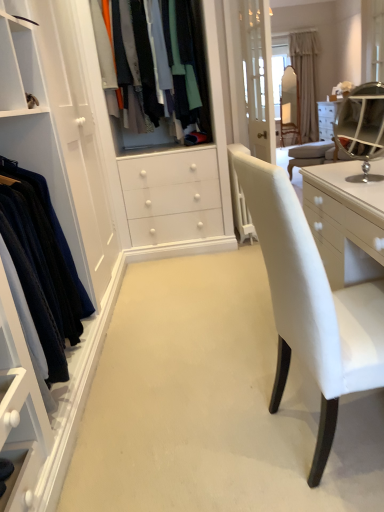
The width and height of the screenshot is (384, 512). What do you see at coordinates (188, 65) in the screenshot?
I see `matte fabric shirts at center, which appears as the 1th clothing when viewed from the back` at bounding box center [188, 65].

Describe the element at coordinates (305, 81) in the screenshot. I see `beige fabric curtain at upper center` at that location.

Locate an element on the screen. The width and height of the screenshot is (384, 512). silver/metallic vanity mirror at upper right is located at coordinates (362, 125).

What are the coordinates of `velvet blue sweater at left, the second clothing positioned from the top` in the screenshot? It's located at (42, 265).

Find the location of a particular element. The height and width of the screenshot is (512, 384). matte fabric shirts at center, placed as the 2th clothing when sorted from front to back is located at coordinates (188, 65).

Is the position of beige fabric curtain at upper center more distant than that of silver/metallic vanity mirror at upper right?

Yes, the depth of beige fabric curtain at upper center is greater than that of silver/metallic vanity mirror at upper right.

Where is `mirror to the left of beige fabric curtain at upper center`? This screenshot has height=512, width=384. mirror to the left of beige fabric curtain at upper center is located at coordinates (362, 125).

What's the angular difference between beige fabric curtain at upper center and silver/metallic vanity mirror at upper right's facing directions?

There is a 52.4-degree angle between the facing directions of beige fabric curtain at upper center and silver/metallic vanity mirror at upper right.

Is beige fabric curtain at upper center taller or shorter than silver/metallic vanity mirror at upper right?

beige fabric curtain at upper center is taller than silver/metallic vanity mirror at upper right.

Does silver/metallic vanity mirror at upper right have a lesser width compared to velvet blue sweater at left, the 2th clothing in the back-to-front sequence?

Yes, silver/metallic vanity mirror at upper right is thinner than velvet blue sweater at left, the 2th clothing in the back-to-front sequence.

Which is in front, point (355, 123) or point (66, 252)?

Positioned in front is point (66, 252).

From the image's perspective, would you say silver/metallic vanity mirror at upper right is shown under velvet blue sweater at left, marked as the first clothing in a front-to-back arrangement?

No, from the image's perspective, silver/metallic vanity mirror at upper right is not below velvet blue sweater at left, marked as the first clothing in a front-to-back arrangement.

Which is nearer, (x=60, y=328) or (x=301, y=112)?

Point (x=60, y=328) appears to be closer to the viewer than point (x=301, y=112).

There is a velvet blue sweater at left, the second clothing positioned from the top. At what (x,y) coordinates should I click in order to perform the action: click on curtain above it (from a real-world perspective). Please return your answer as a coordinate pair (x, y). This screenshot has height=512, width=384. Looking at the image, I should click on (305, 81).

Does velvet blue sweater at left, marked as the first clothing in a front-to-back arrangement, have a lesser width compared to beige fabric curtain at upper center?

No, velvet blue sweater at left, marked as the first clothing in a front-to-back arrangement, is not thinner than beige fabric curtain at upper center.

Does point (311, 50) appear closer or farther from the camera than point (121, 85)?

Point (311, 50) appears to be farther away from the viewer than point (121, 85).

Is beige fabric curtain at upper center spatially inside matte fabric shirts at center, which appears as the 1th clothing when viewed from the back, or outside of it?

beige fabric curtain at upper center cannot be found inside matte fabric shirts at center, which appears as the 1th clothing when viewed from the back.

Considering the sizes of objects beige fabric curtain at upper center and matte fabric shirts at center, arranged as the 1th clothing when viewed from the top, in the image provided, who is smaller, beige fabric curtain at upper center or matte fabric shirts at center, arranged as the 1th clothing when viewed from the top,?

matte fabric shirts at center, arranged as the 1th clothing when viewed from the top, is smaller.

Image resolution: width=384 pixels, height=512 pixels. Identify the location of curtain behind the matte fabric shirts at center, placed as the 2th clothing when sorted from front to back. (305, 81).

Between matte fabric shirts at center, arranged as the second clothing when ordered from the bottom, and beige fabric curtain at upper center, which one has larger width?

With larger width is matte fabric shirts at center, arranged as the second clothing when ordered from the bottom.

From a real-world perspective, between matte fabric shirts at center, arranged as the second clothing when ordered from the bottom, and beige fabric curtain at upper center, who is vertically higher?

In real-world perspective, matte fabric shirts at center, arranged as the second clothing when ordered from the bottom, is above.

From the image's perspective, is matte fabric shirts at center, arranged as the 1th clothing when viewed from the top, above beige fabric curtain at upper center?

Incorrect, from the image's perspective, matte fabric shirts at center, arranged as the 1th clothing when viewed from the top, is lower than beige fabric curtain at upper center.

Is matte fabric shirts at center, arranged as the 1th clothing when viewed from the top, inside the boundaries of beige fabric curtain at upper center, or outside?

matte fabric shirts at center, arranged as the 1th clothing when viewed from the top, is not enclosed by beige fabric curtain at upper center.

From the image's perspective, is silver/metallic vanity mirror at upper right on top of matte fabric shirts at center, placed as the 2th clothing when sorted from front to back?

No, from the image's perspective, silver/metallic vanity mirror at upper right is not on top of matte fabric shirts at center, placed as the 2th clothing when sorted from front to back.

Where is `mirror in front of the matte fabric shirts at center, which appears as the 1th clothing when viewed from the back`? The image size is (384, 512). mirror in front of the matte fabric shirts at center, which appears as the 1th clothing when viewed from the back is located at coordinates (362, 125).

Considering the relative sizes of silver/metallic vanity mirror at upper right and matte fabric shirts at center, which appears as the 1th clothing when viewed from the back, in the image provided, is silver/metallic vanity mirror at upper right bigger than matte fabric shirts at center, which appears as the 1th clothing when viewed from the back,?

No.

Looking at this image, from a real-world perspective, does silver/metallic vanity mirror at upper right stand above matte fabric shirts at center, arranged as the second clothing when ordered from the bottom?

Actually, silver/metallic vanity mirror at upper right is physically below matte fabric shirts at center, arranged as the second clothing when ordered from the bottom, in the real world.

From a real-world perspective, relative to velvet blue sweater at left, the 2th clothing in the back-to-front sequence, is beige fabric curtain at upper center vertically above or below?

beige fabric curtain at upper center is situated higher than velvet blue sweater at left, the 2th clothing in the back-to-front sequence, in the real world.

How much distance is there between beige fabric curtain at upper center and velvet blue sweater at left, which ranks as the 1th clothing in bottom-to-top order?

A distance of 5.32 meters exists between beige fabric curtain at upper center and velvet blue sweater at left, which ranks as the 1th clothing in bottom-to-top order.

From the image's perspective, does beige fabric curtain at upper center appear lower than velvet blue sweater at left, marked as the first clothing in a front-to-back arrangement?

No.

Considering their positions, is beige fabric curtain at upper center located in front of or behind velvet blue sweater at left, marked as the first clothing in a front-to-back arrangement?

beige fabric curtain at upper center is behind velvet blue sweater at left, marked as the first clothing in a front-to-back arrangement.

The width and height of the screenshot is (384, 512). What are the coordinates of `mirror below the beige fabric curtain at upper center (from the image's perspective)` in the screenshot? It's located at (362, 125).

You are a GUI agent. You are given a task and a screenshot of the screen. Output one action in this format:
    pyautogui.click(x=<x>, y=<y>)
    Task: Click on the mirror that appears behind the velvet blue sweater at left, which ranks as the 1th clothing in bottom-to-top order
    
    Given the screenshot: What is the action you would take?
    pyautogui.click(x=362, y=125)

Considering their positions, is velvet blue sweater at left, which ranks as the 1th clothing in bottom-to-top order, positioned closer to matte fabric shirts at center, placed as the 2th clothing when sorted from front to back, than silver/metallic vanity mirror at upper right?

silver/metallic vanity mirror at upper right lies closer to matte fabric shirts at center, placed as the 2th clothing when sorted from front to back, than the other object.

Which object lies further to the anchor point velvet blue sweater at left, the 2th clothing in the back-to-front sequence, matte fabric shirts at center, placed as the 2th clothing when sorted from front to back, or beige fabric curtain at upper center?

Among the two, beige fabric curtain at upper center is located further to velvet blue sweater at left, the 2th clothing in the back-to-front sequence.

Estimate the real-world distances between objects in this image. Which object is further from matte fabric shirts at center, arranged as the 1th clothing when viewed from the top, silver/metallic vanity mirror at upper right or beige fabric curtain at upper center?

beige fabric curtain at upper center is positioned further to the anchor matte fabric shirts at center, arranged as the 1th clothing when viewed from the top.

Looking at the image, which one is located closer to beige fabric curtain at upper center, velvet blue sweater at left, the second clothing positioned from the top, or silver/metallic vanity mirror at upper right?

Based on the image, silver/metallic vanity mirror at upper right appears to be nearer to beige fabric curtain at upper center.

When comparing their distances from matte fabric shirts at center, which appears as the 1th clothing when viewed from the back, does silver/metallic vanity mirror at upper right or velvet blue sweater at left, which ranks as the 1th clothing in bottom-to-top order, seem closer?

Based on the image, silver/metallic vanity mirror at upper right appears to be nearer to matte fabric shirts at center, which appears as the 1th clothing when viewed from the back.

Looking at the image, which one is located closer to matte fabric shirts at center, placed as the 2th clothing when sorted from front to back, velvet blue sweater at left, marked as the first clothing in a front-to-back arrangement, or beige fabric curtain at upper center?

velvet blue sweater at left, marked as the first clothing in a front-to-back arrangement, is closer to matte fabric shirts at center, placed as the 2th clothing when sorted from front to back.

From the image, which object appears to be nearer to beige fabric curtain at upper center, matte fabric shirts at center, arranged as the second clothing when ordered from the bottom, or silver/metallic vanity mirror at upper right?

silver/metallic vanity mirror at upper right.

Consider the image. Considering their positions, is silver/metallic vanity mirror at upper right positioned closer to velvet blue sweater at left, marked as the first clothing in a front-to-back arrangement, than matte fabric shirts at center, arranged as the 1th clothing when viewed from the top?

Based on the image, matte fabric shirts at center, arranged as the 1th clothing when viewed from the top, appears to be nearer to velvet blue sweater at left, marked as the first clothing in a front-to-back arrangement.

Locate an element on the screen. The width and height of the screenshot is (384, 512). mirror located between velvet blue sweater at left, which ranks as the 1th clothing in bottom-to-top order, and beige fabric curtain at upper center in the depth direction is located at coordinates (362, 125).

This screenshot has height=512, width=384. What are the coordinates of `clothing between velvet blue sweater at left, the second clothing positioned from the top, and beige fabric curtain at upper center from front to back` in the screenshot? It's located at (188, 65).

This screenshot has width=384, height=512. What are the coordinates of `mirror between velvet blue sweater at left, marked as the first clothing in a front-to-back arrangement, and matte fabric shirts at center, arranged as the second clothing when ordered from the bottom, in the front-back direction` in the screenshot? It's located at (362, 125).

This screenshot has width=384, height=512. I want to click on clothing between silver/metallic vanity mirror at upper right and beige fabric curtain at upper center along the z-axis, so click(x=188, y=65).